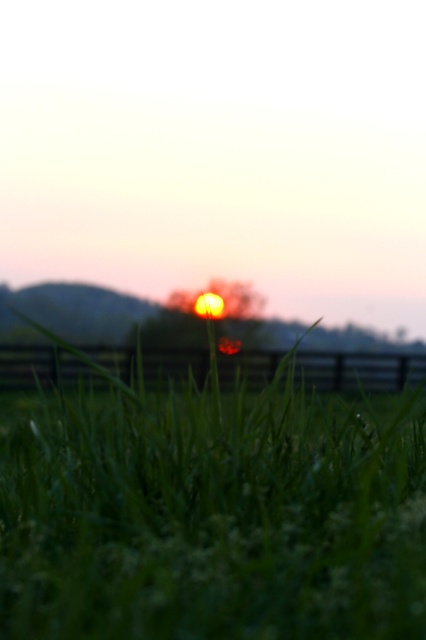
Question: Which object is closer to the camera taking this photo?

Choices:
 (A) black wooden fence at lower center
 (B) green grassy at center

Answer: (B)

Question: In this image, where is green grassy at center located relative to black wooden fence at lower center?

Choices:
 (A) right
 (B) left

Answer: (A)

Question: Which of the following is the closest to the observer?

Choices:
 (A) (219, 369)
 (B) (207, 467)

Answer: (B)

Question: Is green grassy at center smaller than black wooden fence at lower center?

Choices:
 (A) no
 (B) yes

Answer: (B)

Question: Can you confirm if green grassy at center is smaller than black wooden fence at lower center?

Choices:
 (A) no
 (B) yes

Answer: (B)